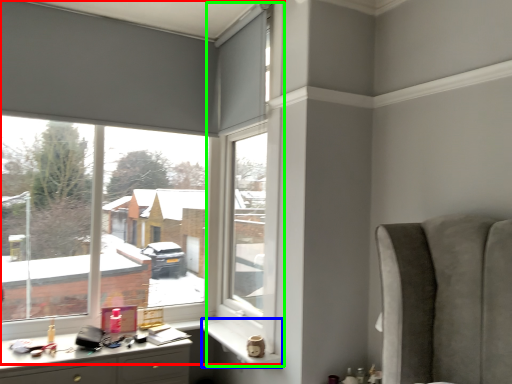
Question: Which object is the farthest from window (highlighted by a red box)? Choose among these: window sill (highlighted by a blue box) or window frame (highlighted by a green box).

Choices:
 (A) window sill
 (B) window frame

Answer: (A)